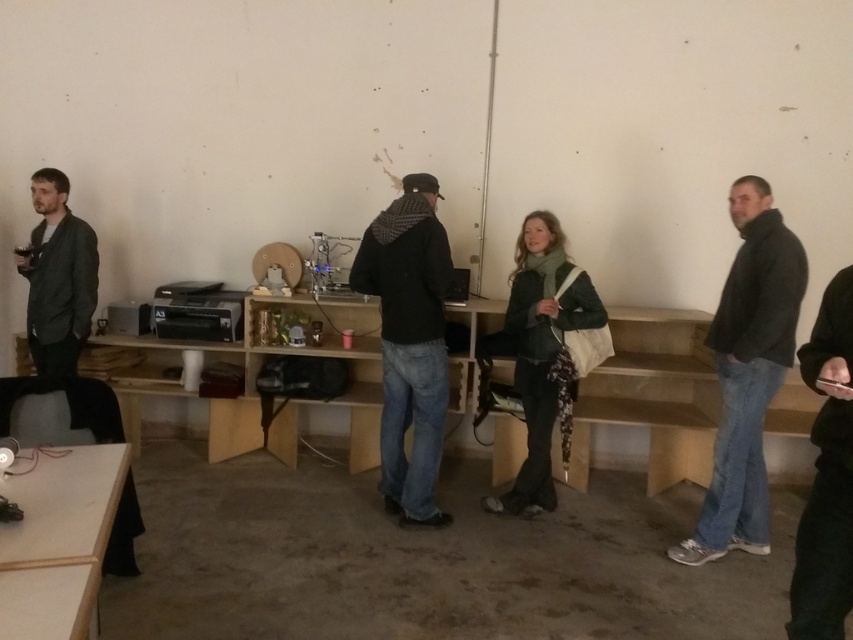
You are standing at the entrance of the room. You see a dark gray jacket at center represented by point (747, 372). Is the dark gray jacket at center facing towards you or away from you?

The dark gray jacket at center is facing away from you because the point (747, 372) indicates that the person is positioned with their back towards the camera, which is your perspective as the observer.

You are standing at the center of the room and want to place a new object at the exact center of the room. The light brown wooden table at lower left is located at coordinates 0.808, 0.079. Where should you place the new object?

The exact center of the room would be at coordinates (x=426, y=320). Since the light brown wooden table at lower left is at (x=67, y=516), you should place the new object at the center point of the room, which is (x=426, y=320).

You are organizing a small event in this room and need to place a 2x3 foot tablecloth on the light brown wooden table at lower left. Considering the size of the matte black jacket at left, will the tablecloth likely fit without overlapping onto the jacket?

The light brown wooden table at lower left is larger than the matte black jacket at left. Since the table is bigger, the 2x3 foot tablecloth should fit without overlapping onto the jacket.